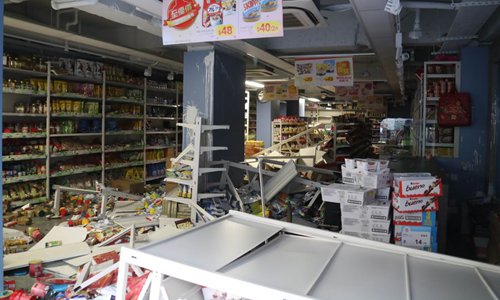
I want to click on fallen white shelf, so click(222, 246), click(359, 283).